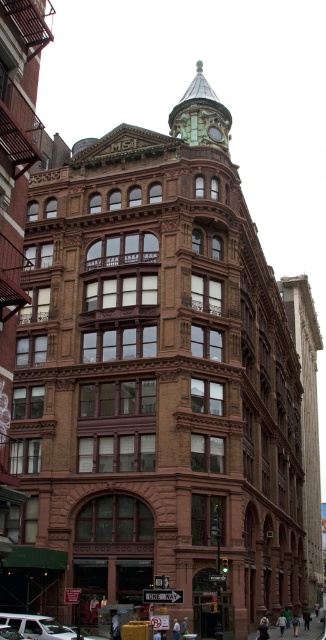
Is point (34, 627) closer to camera compared to point (212, 134)?

Yes, it is.

Which of these two, white matte van at lower left or green glass clock at upper center, stands shorter?

green glass clock at upper center

Describe the element at coordinates (36, 627) in the screenshot. This screenshot has width=326, height=640. I see `white matte van at lower left` at that location.

Locate an element on the screen. This screenshot has width=326, height=640. white matte van at lower left is located at coordinates (36, 627).